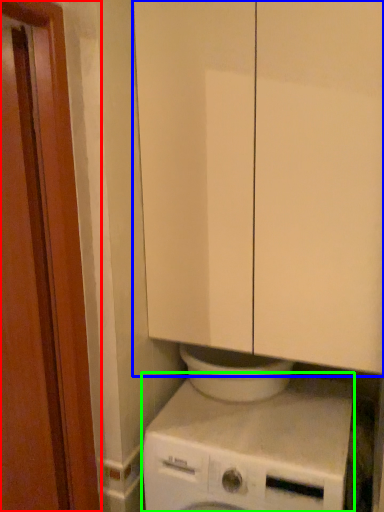
Question: Which object is positioned closest to screen door (highlighted by a red box)? Select from cabinetry (highlighted by a blue box) and washing machine (highlighted by a green box).

Choices:
 (A) cabinetry
 (B) washing machine

Answer: (A)